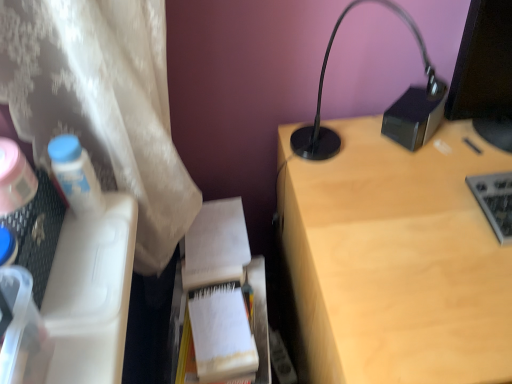
Where is `spots to the right of black matte speaker at upper right`? spots to the right of black matte speaker at upper right is located at coordinates (473, 135).